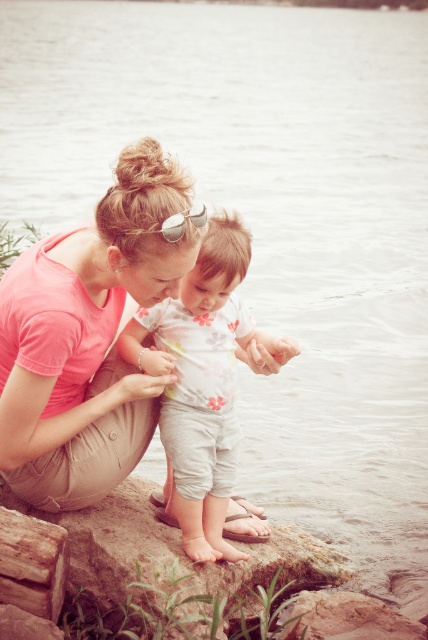
Between pink matte shirt at center and sunglasses at center, which one is positioned lower?

pink matte shirt at center

Between pink matte shirt at center and sunglasses at center, which one is positioned higher?

sunglasses at center

Locate an element on the screen. This screenshot has width=428, height=640. pink matte shirt at center is located at coordinates (88, 339).

Find the location of a particular element. This screenshot has width=428, height=640. pink matte shirt at center is located at coordinates (88, 339).

Which is more to the right, pink matte shirt at center or floral-patterned onesie at center?

floral-patterned onesie at center

Identify the location of pink matte shirt at center. (88, 339).

This screenshot has height=640, width=428. Find the location of `pink matte shirt at center`. pink matte shirt at center is located at coordinates (88, 339).

Does point (287, 596) come closer to viewer compared to point (196, 205)?

No, (287, 596) is further to viewer.

Is smooth gray rock at center to the left of sunglasses at center from the viewer's perspective?

In fact, smooth gray rock at center is to the right of sunglasses at center.

This screenshot has height=640, width=428. Identify the location of smooth gray rock at center. (177, 568).